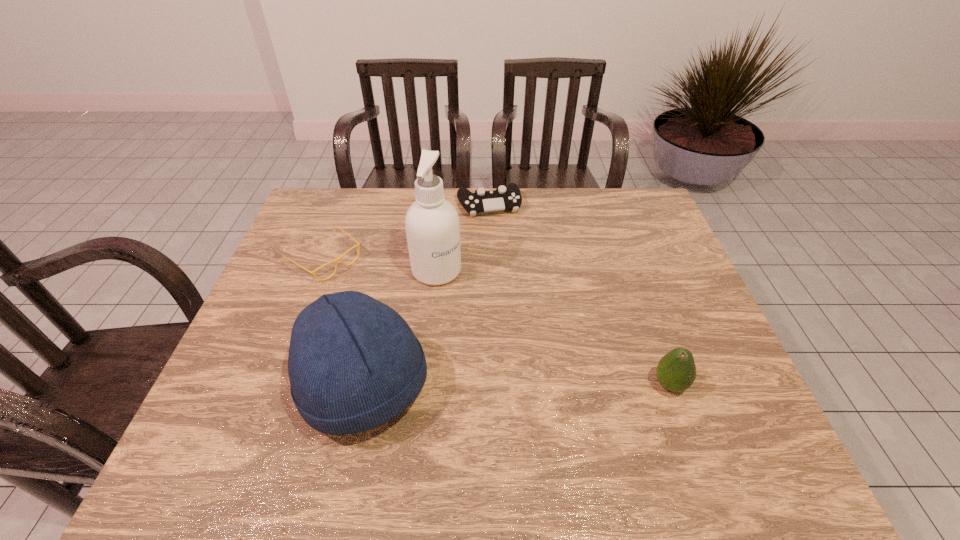
This screenshot has height=540, width=960. I want to click on the fourth shortest object, so click(354, 363).

You are a GUI agent. You are given a task and a screenshot of the screen. Output one action in this format:
    pyautogui.click(x=<x>, y=<y>)
    Task: Click on the rightmost object
    This screenshot has width=960, height=540.
    Given the screenshot: What is the action you would take?
    pyautogui.click(x=676, y=371)

This screenshot has height=540, width=960. I want to click on avocado, so click(676, 371).

The width and height of the screenshot is (960, 540). What are the coordinates of `cleansing agent` in the screenshot? It's located at (432, 225).

You are a GUI agent. You are given a task and a screenshot of the screen. Output one action in this format:
    pyautogui.click(x=<x>, y=<y>)
    Task: Click on the farthest object
    The height and width of the screenshot is (540, 960).
    Given the screenshot: What is the action you would take?
    [x=502, y=198]

At what (x,y) coordinates should I click in order to perform the action: click on control. Please return your answer as a coordinate pair (x, y). The width and height of the screenshot is (960, 540). Looking at the image, I should click on click(x=502, y=198).

I want to click on the shortest object, so click(x=338, y=259).

Where is `blank area located 0.110m on the right of the skullcap`? The width and height of the screenshot is (960, 540). blank area located 0.110m on the right of the skullcap is located at coordinates (478, 387).

Identify the location of free space located on the back of the third tallest object. The height and width of the screenshot is (540, 960). click(x=650, y=329).

Identify the location of vacant space situated on the front label of the tallest object. This screenshot has height=540, width=960. (543, 369).